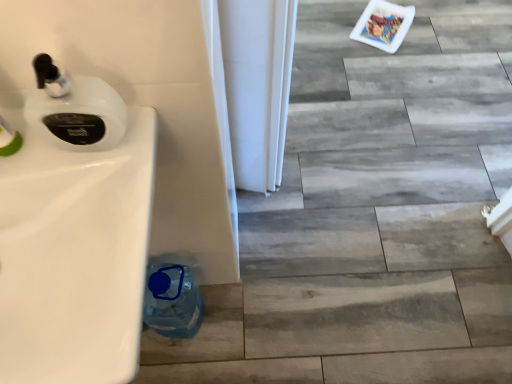
Question: Is blue plastic bottle at lower left located within white glossy sink at left?

Choices:
 (A) yes
 (B) no

Answer: (B)

Question: Does white glossy sink at left have a greater height compared to blue plastic bottle at lower left?

Choices:
 (A) no
 (B) yes

Answer: (A)

Question: From a real-world perspective, is white glossy sink at left over blue plastic bottle at lower left?

Choices:
 (A) no
 (B) yes

Answer: (B)

Question: From the image's perspective, is white glossy sink at left over blue plastic bottle at lower left?

Choices:
 (A) no
 (B) yes

Answer: (B)

Question: Does white glossy sink at left have a larger size compared to blue plastic bottle at lower left?

Choices:
 (A) yes
 (B) no

Answer: (B)

Question: Is white glossy soap dispenser at upper left taller or shorter than blue plastic bottle at lower left?

Choices:
 (A) tall
 (B) short

Answer: (B)

Question: Considering the positions of white glossy soap dispenser at upper left and blue plastic bottle at lower left in the image, is white glossy soap dispenser at upper left bigger or smaller than blue plastic bottle at lower left?

Choices:
 (A) small
 (B) big

Answer: (A)

Question: Does point (65, 82) appear closer or farther from the camera than point (154, 327)?

Choices:
 (A) closer
 (B) farther

Answer: (A)

Question: Is white glossy soap dispenser at upper left situated inside blue plastic bottle at lower left or outside?

Choices:
 (A) outside
 (B) inside

Answer: (A)

Question: From the image's perspective, is white glossy sink at left positioned above or below blue plastic bottle at lower left?

Choices:
 (A) below
 (B) above

Answer: (B)

Question: Is white glossy sink at left to the left or to the right of blue plastic bottle at lower left in the image?

Choices:
 (A) left
 (B) right

Answer: (A)

Question: Is white glossy sink at left inside the boundaries of blue plastic bottle at lower left, or outside?

Choices:
 (A) inside
 (B) outside

Answer: (B)

Question: Considering the positions of point (87, 294) and point (172, 314), is point (87, 294) closer or farther from the camera than point (172, 314)?

Choices:
 (A) closer
 (B) farther

Answer: (A)

Question: Is blue plastic bottle at lower left situated inside white glossy sink at left or outside?

Choices:
 (A) inside
 (B) outside

Answer: (B)

Question: Considering the positions of blue plastic bottle at lower left and white glossy sink at left in the image, is blue plastic bottle at lower left wider or thinner than white glossy sink at left?

Choices:
 (A) thin
 (B) wide

Answer: (A)